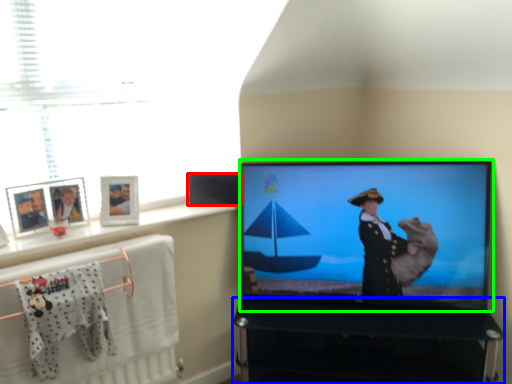
Question: Which is nearer to the speaker (highlighted by a red box)? furniture (highlighted by a blue box) or television (highlighted by a green box).

Choices:
 (A) furniture
 (B) television

Answer: (B)